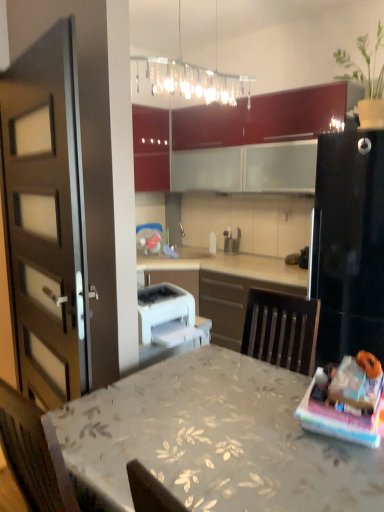
I want to click on free region on the left part of metallic silver spice shakers at center, the 1th appliance in the right-to-left sequence, so click(210, 257).